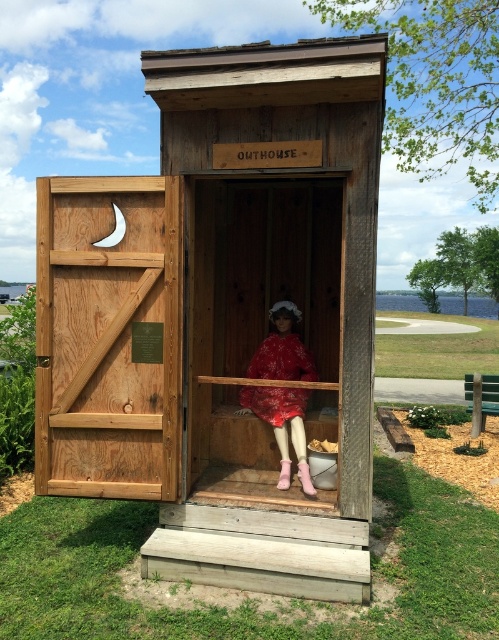
The image size is (499, 640). Describe the element at coordinates (282, 426) in the screenshot. I see `matte red dress at center` at that location.

Is point (262, 371) more distant than point (265, 353)?

No, (262, 371) is closer to viewer.

Where is `matte red dress at center`? This screenshot has height=640, width=499. matte red dress at center is located at coordinates (282, 426).

Is wooden outhouse at center thinner than red velvet dress at center?

Incorrect, wooden outhouse at center's width is not less than red velvet dress at center's.

Can you confirm if wooden outhouse at center is positioned above red velvet dress at center?

Yes.

Who is more forward, (312, 596) or (304, 349)?

Point (312, 596)

This screenshot has width=499, height=640. I want to click on wooden outhouse at center, so click(222, 314).

Does wooden outhouse at center lie in front of matte red dress at center?

Yes, it is.

How much distance is there between wooden outhouse at center and matte red dress at center?

wooden outhouse at center and matte red dress at center are 23.05 inches apart.

Between point (248, 490) and point (285, 312), which one is positioned in front?

Positioned in front is point (248, 490).

The width and height of the screenshot is (499, 640). I want to click on wooden outhouse at center, so click(x=222, y=314).